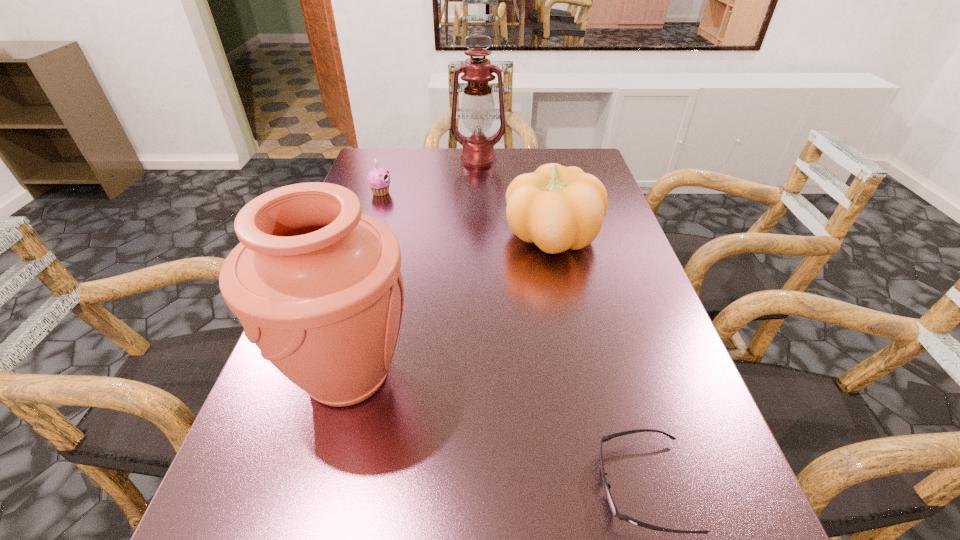
You are a GUI agent. You are given a task and a screenshot of the screen. Output one action in this format:
    pyautogui.click(x=<x>, y=<y>)
    Task: Click on the object situated at the far edge
    
    Given the screenshot: What is the action you would take?
    pyautogui.click(x=478, y=108)

Where is `vase that is at the left edge`? vase that is at the left edge is located at coordinates (317, 285).

Image resolution: width=960 pixels, height=540 pixels. I want to click on cupcake present at the left edge, so click(x=378, y=179).

At what (x,y) coordinates should I click in order to perform the action: click on object at the right edge. Please return your answer as a coordinate pair (x, y). The width and height of the screenshot is (960, 540). Looking at the image, I should click on (558, 208).

At what (x,y) coordinates should I click in order to perform the action: click on vacant region at the far edge of the desktop. Please return your answer as a coordinate pair (x, y). Looking at the image, I should click on (519, 172).

I want to click on free space at the left edge, so click(x=266, y=505).

Find the location of a particular element. The width and height of the screenshot is (960, 540). blank space at the right edge of the desktop is located at coordinates (632, 325).

You are a GUI agent. You are given a task and a screenshot of the screen. Output one action in this format:
    pyautogui.click(x=<x>, y=<y>)
    Task: Click on the vacant space at the far left corner of the desktop
    The image size is (960, 540).
    Given the screenshot: What is the action you would take?
    pyautogui.click(x=368, y=156)

In the image, there is a desktop. Where is `vacant space at the far right corner`? The image size is (960, 540). vacant space at the far right corner is located at coordinates (581, 163).

Where is `vacant space in between the fourth farthest object and the third tallest object`? Image resolution: width=960 pixels, height=540 pixels. vacant space in between the fourth farthest object and the third tallest object is located at coordinates (450, 306).